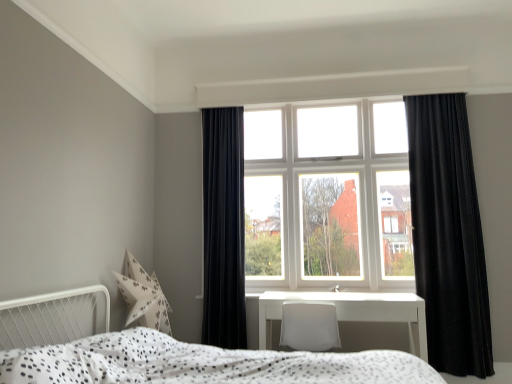
Question: Is velvet black curtain at left, the first curtain positioned from the left, oriented away from white glossy table at center?

Choices:
 (A) no
 (B) yes

Answer: (A)

Question: Are velvet black curtain at left, the first curtain positioned from the left, and white glossy table at center far apart?

Choices:
 (A) yes
 (B) no

Answer: (B)

Question: Are velvet black curtain at left, the second curtain in the right-to-left sequence, and white glossy table at center making contact?

Choices:
 (A) yes
 (B) no

Answer: (B)

Question: From a real-world perspective, is velvet black curtain at left, the first curtain positioned from the left, on white glossy table at center?

Choices:
 (A) no
 (B) yes

Answer: (B)

Question: Is velvet black curtain at left, the second curtain in the right-to-left sequence, at the right side of white glossy table at center?

Choices:
 (A) yes
 (B) no

Answer: (B)

Question: Is white glossy table at center wider or thinner than white glass window at center?

Choices:
 (A) thin
 (B) wide

Answer: (B)

Question: Relative to white glass window at center, is white glossy table at center in front or behind?

Choices:
 (A) behind
 (B) front

Answer: (B)

Question: In terms of height, does white glossy table at center look taller or shorter compared to white glass window at center?

Choices:
 (A) tall
 (B) short

Answer: (B)

Question: Does point (361, 307) appear closer or farther from the camera than point (332, 243)?

Choices:
 (A) farther
 (B) closer

Answer: (B)

Question: In terms of height, does white glass window at center look taller or shorter compared to velvet black curtain at left, the first curtain positioned from the left?

Choices:
 (A) tall
 (B) short

Answer: (B)

Question: In the image, is white glass window at center positioned in front of or behind velvet black curtain at left, the second curtain in the right-to-left sequence?

Choices:
 (A) behind
 (B) front

Answer: (A)

Question: Does point (403, 236) appear closer or farther from the camera than point (220, 345)?

Choices:
 (A) farther
 (B) closer

Answer: (A)

Question: From the image's perspective, is white glass window at center positioned above or below velvet black curtain at left, the second curtain in the right-to-left sequence?

Choices:
 (A) above
 (B) below

Answer: (A)

Question: Is white dotted fabric bed at lower center to the left or to the right of white glass window at center in the image?

Choices:
 (A) left
 (B) right

Answer: (A)

Question: In the image, is white dotted fabric bed at lower center positioned in front of or behind white glass window at center?

Choices:
 (A) front
 (B) behind

Answer: (A)